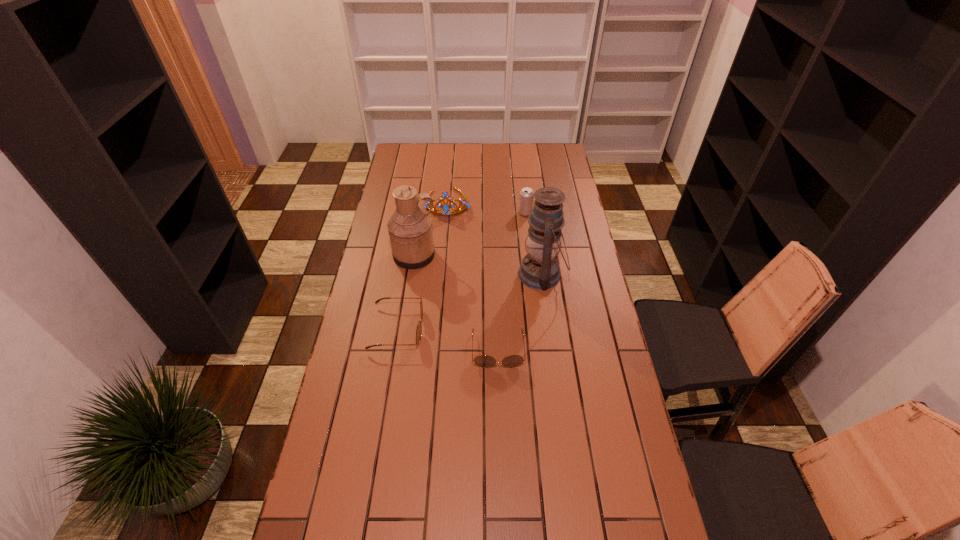
Find the location of a particular element. the second closest object to the oil lamp is located at coordinates (526, 197).